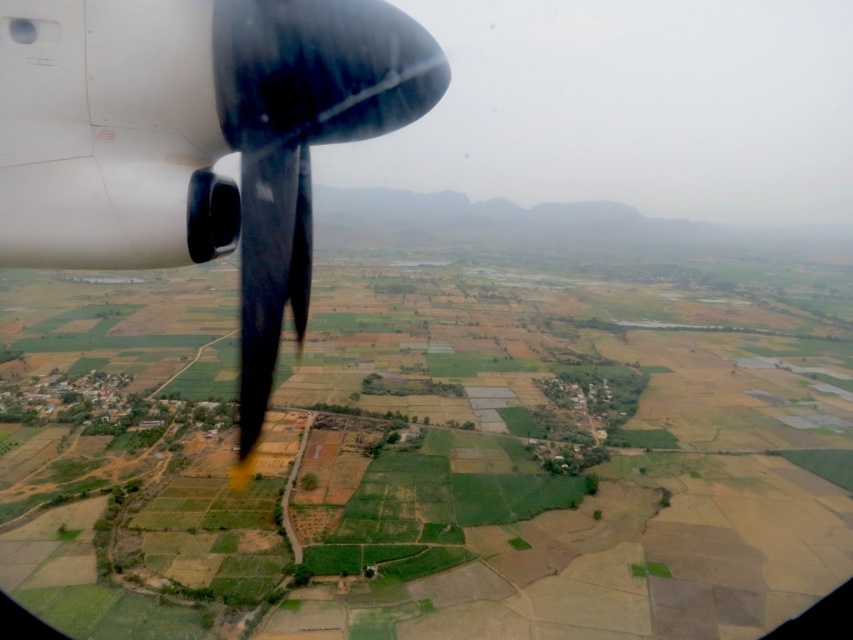
You are a pilot who needs to assess the visibility of the green grassy farmland at center and the polished metallic propeller at upper left during flight. Which object appears bigger in your view?

The green grassy farmland at center appears bigger in the view because it has a larger size compared to the polished metallic propeller at upper left.

You are a pilot navigating an aircraft and need to identify the location of the green grassy farmland at center. According to the coordinates provided, where exactly is it located?

The green grassy farmland at center is located at point (437,451).